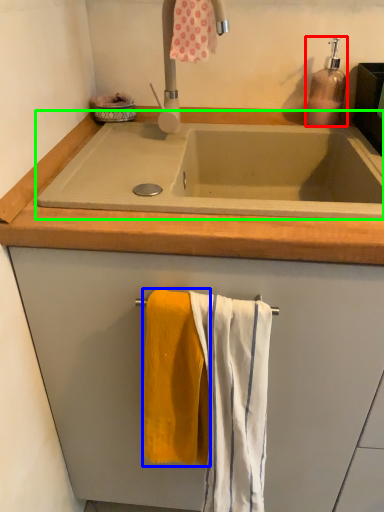
Question: Considering the real-world distances, which object is closest to soap dispenser (highlighted by a red box)? bath towel (highlighted by a blue box) or bath (highlighted by a green box).

Choices:
 (A) bath towel
 (B) bath

Answer: (B)